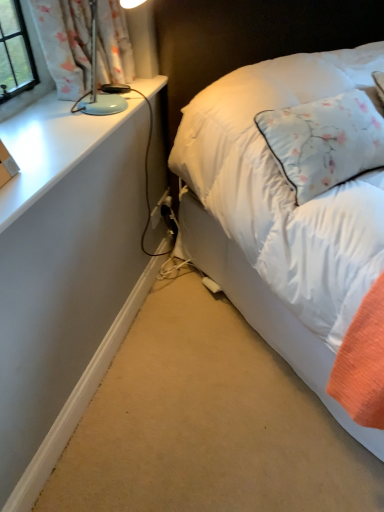
Question: Is white matte desk at lower left in front of or behind white soft bed at right in the image?

Choices:
 (A) front
 (B) behind

Answer: (B)

Question: Is point (72, 338) positioned closer to the camera than point (309, 360)?

Choices:
 (A) farther
 (B) closer

Answer: (B)

Question: Which of these objects is positioned closest to the matte blue lamp at upper left?

Choices:
 (A) white soft bed at right
 (B) white matte desk at lower left

Answer: (B)

Question: Which is nearer to the white soft bed at right?

Choices:
 (A) white matte desk at lower left
 (B) matte blue lamp at upper left

Answer: (A)